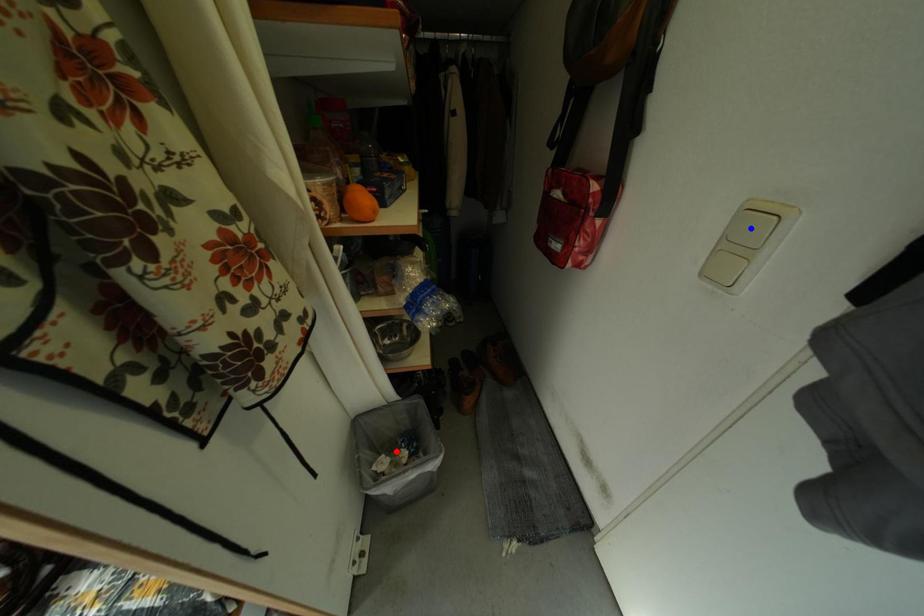
Question: Two points are marked on the image. Which point is closer to the camera?

Choices:
 (A) Blue point is closer.
 (B) Red point is closer.

Answer: (A)